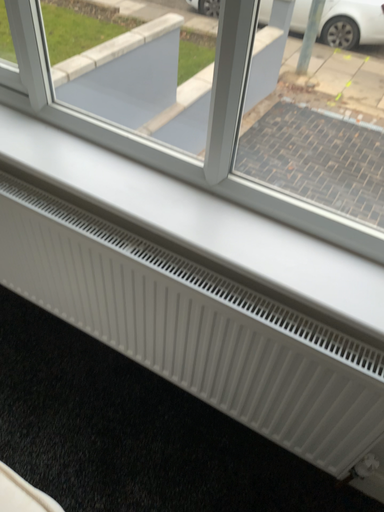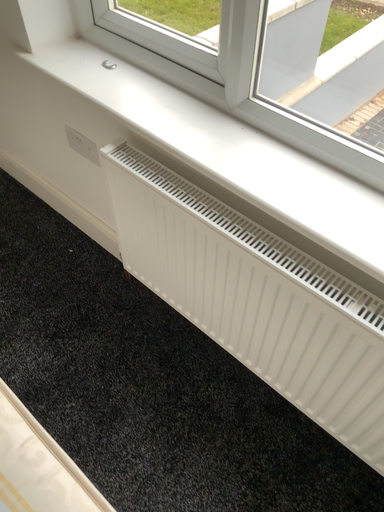
Question: How did the camera likely rotate when shooting the video?

Choices:
 (A) rotated right
 (B) rotated left

Answer: (B)